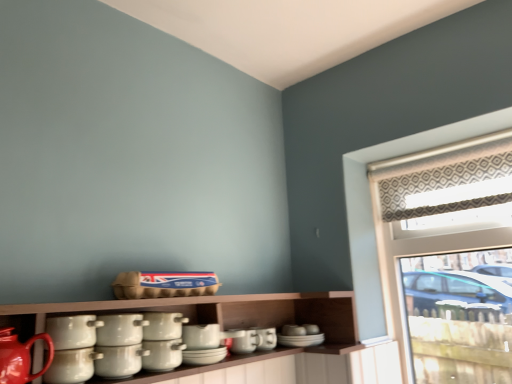
The height and width of the screenshot is (384, 512). Describe the element at coordinates (73, 331) in the screenshot. I see `white glossy pot at lower left, the second tableware from the front` at that location.

What is the approximate height of matte ceramic cup at center, which is the 9th tableware from front to back?

matte ceramic cup at center, which is the 9th tableware from front to back, is 3.18 inches in height.

The width and height of the screenshot is (512, 384). What are the coordinates of `white ceramic pot at center, marked as the 4th tableware in a back-to-front arrangement` in the screenshot? It's located at (163, 325).

Find the location of a particular element. matte red teapot at lower left is located at coordinates (20, 357).

Does matte white cup at center, marked as the second tableware in a back-to-front arrangement, contain white ceramic pot at center, marked as the 4th tableware in a back-to-front arrangement?

No, white ceramic pot at center, marked as the 4th tableware in a back-to-front arrangement, is not inside matte white cup at center, marked as the second tableware in a back-to-front arrangement.

Considering the sizes of objects matte white cup at center, marked as the second tableware in a back-to-front arrangement, and white ceramic pot at center, marked as the 4th tableware in a back-to-front arrangement, in the image provided, who is taller, matte white cup at center, marked as the second tableware in a back-to-front arrangement, or white ceramic pot at center, marked as the 4th tableware in a back-to-front arrangement,?

With more height is matte white cup at center, marked as the second tableware in a back-to-front arrangement.

Are matte white cup at center, marked as the second tableware in a back-to-front arrangement, and white ceramic pot at center, marked as the 4th tableware in a back-to-front arrangement, far apart?

No, matte white cup at center, marked as the second tableware in a back-to-front arrangement, is in close proximity to white ceramic pot at center, marked as the 4th tableware in a back-to-front arrangement.

Considering the sizes of matte white cup at center, which is the 8th tableware in front-to-back order, and white ceramic pot at center, marked as the 4th tableware in a back-to-front arrangement, in the image, is matte white cup at center, which is the 8th tableware in front-to-back order, bigger or smaller than white ceramic pot at center, marked as the 4th tableware in a back-to-front arrangement,?

matte white cup at center, which is the 8th tableware in front-to-back order, is smaller than white ceramic pot at center, marked as the 4th tableware in a back-to-front arrangement.

Could you tell me if white ceramic pot at center, marked as the 4th tableware in a back-to-front arrangement, is facing white glossy cup at center, which is counted as the 7th tableware, starting from the front?

No, white ceramic pot at center, marked as the 4th tableware in a back-to-front arrangement, is not turned towards white glossy cup at center, which is counted as the 7th tableware, starting from the front.

Identify the location of the 3rd tableware above the white glossy cup at center, which is counted as the 7th tableware, starting from the front (from the image's perspective). pyautogui.click(x=163, y=325).

Is the surface of white ceramic pot at center, marked as the 4th tableware in a back-to-front arrangement, in direct contact with white glossy cup at center, which is counted as the 7th tableware, starting from the front?

Yes, the surface of white ceramic pot at center, marked as the 4th tableware in a back-to-front arrangement, is in contact with white glossy cup at center, which is counted as the 7th tableware, starting from the front.

Is matte ceramic cup at center, the first tableware from the back, to the right of white glossy cup at left, which is the 9th tableware in back-to-front order, from the viewer's perspective?

Yes, matte ceramic cup at center, the first tableware from the back, is to the right of white glossy cup at left, which is the 9th tableware in back-to-front order.

Is matte ceramic cup at center, which is the 9th tableware from front to back, turned away from white glossy cup at left, acting as the first tableware starting from the front?

No, matte ceramic cup at center, which is the 9th tableware from front to back,'s orientation is not away from white glossy cup at left, acting as the first tableware starting from the front.

Is white glossy cup at left, acting as the first tableware starting from the front, completely or partially inside matte ceramic cup at center, the first tableware from the back?

No, white glossy cup at left, acting as the first tableware starting from the front, is not inside matte ceramic cup at center, the first tableware from the back.

Is matte red teapot at lower left closer to camera compared to white glossy pots at center, marked as the 3th tableware in a front-to-back arrangement?

Yes, matte red teapot at lower left is closer to the viewer.

Which object is thinner, matte red teapot at lower left or white glossy pots at center, marked as the 3th tableware in a front-to-back arrangement?

Thinner between the two is matte red teapot at lower left.

What's the angular difference between matte red teapot at lower left and white glossy pots at center, marked as the 3th tableware in a front-to-back arrangement,'s facing directions?

The angular difference between matte red teapot at lower left and white glossy pots at center, marked as the 3th tableware in a front-to-back arrangement, is 0.19 degrees.

Considering the points (6, 358) and (112, 353), which point is behind, point (6, 358) or point (112, 353)?

The point (112, 353) is behind.

Can you confirm if white glossy pot at center, placed as the sixth tableware when sorted from back to front, is taller than white glossy pots at center, marked as the 3th tableware in a front-to-back arrangement?

No, white glossy pot at center, placed as the sixth tableware when sorted from back to front, is not taller than white glossy pots at center, marked as the 3th tableware in a front-to-back arrangement.

Which object is more forward, white glossy pot at center, acting as the fourth tableware starting from the front, or white glossy pots at center, marked as the 3th tableware in a front-to-back arrangement?

white glossy pots at center, marked as the 3th tableware in a front-to-back arrangement, is closer to the camera.

The image size is (512, 384). I want to click on the 1st tableware to the left of the white glossy pot at center, placed as the sixth tableware when sorted from back to front, starting your count from the anchor, so click(x=119, y=361).

Does white glossy pot at center, placed as the sixth tableware when sorted from back to front, have a larger size compared to white glossy pots at center, the seventh tableware when ordered from back to front?

No, white glossy pot at center, placed as the sixth tableware when sorted from back to front, is not bigger than white glossy pots at center, the seventh tableware when ordered from back to front.

Based on their positions, is white glossy pots at center, marked as the 3th tableware in a front-to-back arrangement, located to the left or right of matte white cup at center, marked as the second tableware in a back-to-front arrangement?

white glossy pots at center, marked as the 3th tableware in a front-to-back arrangement, is to the left of matte white cup at center, marked as the second tableware in a back-to-front arrangement.

Can you tell me how much white glossy pots at center, marked as the 3th tableware in a front-to-back arrangement, and matte white cup at center, marked as the second tableware in a back-to-front arrangement, differ in facing direction?

The angular difference between white glossy pots at center, marked as the 3th tableware in a front-to-back arrangement, and matte white cup at center, marked as the second tableware in a back-to-front arrangement, is 0.000328 degrees.

From the image's perspective, starting from the matte white cup at center, marked as the second tableware in a back-to-front arrangement, which tableware is the 3rd one above? Please provide its 2D coordinates.

[(119, 361)]

From the image's perspective, which is below, white glossy pots at center, the seventh tableware when ordered from back to front, or matte white cup at center, marked as the second tableware in a back-to-front arrangement?

matte white cup at center, marked as the second tableware in a back-to-front arrangement.

Which of these two, patterned fabric at upper right or white glossy pot at lower left, the second tableware from the front, is wider?

Wider between the two is patterned fabric at upper right.

Which is behind, point (455, 216) or point (64, 344)?

The point (455, 216) is more distant.

Would you say patterned fabric at upper right is to the left or to the right of white glossy pot at lower left, the eighth tableware viewed from the back, in the picture?

From the image, it's evident that patterned fabric at upper right is to the right of white glossy pot at lower left, the eighth tableware viewed from the back.

Is patterned fabric at upper right beside white glossy pot at lower left, the second tableware from the front?

No, patterned fabric at upper right is not beside white glossy pot at lower left, the second tableware from the front.

Starting from the matte white cup at center, which is the 8th tableware in front-to-back order, which tableware is the 3rd one to the left? Please provide its 2D coordinates.

[(163, 325)]

Where is `tableware that is the 3rd one when counting upward from the white glossy cup at center, the third tableware positioned from the back (from the image's perspective)`? This screenshot has width=512, height=384. tableware that is the 3rd one when counting upward from the white glossy cup at center, the third tableware positioned from the back (from the image's perspective) is located at coordinates (163, 325).

Based on their spatial positions, is matte red teapot at lower left or matte white cup at center, marked as the second tableware in a back-to-front arrangement, closer to white ceramic pot at center, the sixth tableware in the front-to-back sequence?

matte white cup at center, marked as the second tableware in a back-to-front arrangement, is positioned closer to the anchor white ceramic pot at center, the sixth tableware in the front-to-back sequence.

Which object lies further to the anchor point white glossy pots at center, which is counted as the 5th tableware, starting from the back, white glossy cup at center, which is counted as the 7th tableware, starting from the front, or white glossy pot at center, acting as the fourth tableware starting from the front?

white glossy cup at center, which is counted as the 7th tableware, starting from the front, lies further to white glossy pots at center, which is counted as the 5th tableware, starting from the back, than the other object.

Looking at the image, which one is located closer to patterned fabric at upper right, white glossy cup at center, the third tableware positioned from the back, or white glossy pots at center, which is counted as the 5th tableware, starting from the back?

white glossy cup at center, the third tableware positioned from the back, is positioned closer to the anchor patterned fabric at upper right.

Based on their spatial positions, is white glossy cup at left, which is the 9th tableware in back-to-front order, or white glossy pot at center, acting as the fourth tableware starting from the front, further from patterned fabric at upper right?

Based on the image, white glossy cup at left, which is the 9th tableware in back-to-front order, appears to be further to patterned fabric at upper right.

Based on their spatial positions, is white glossy pot at center, acting as the fourth tableware starting from the front, or white glossy cup at center, which is counted as the 7th tableware, starting from the front, further from patterned fabric at upper right?

Based on the image, white glossy pot at center, acting as the fourth tableware starting from the front, appears to be further to patterned fabric at upper right.

Based on their spatial positions, is white glossy pot at center, acting as the fourth tableware starting from the front, or matte white cup at center, which is the 8th tableware in front-to-back order, closer to matte ceramic cup at center, which is the 9th tableware from front to back?

matte white cup at center, which is the 8th tableware in front-to-back order, is closer to matte ceramic cup at center, which is the 9th tableware from front to back.

Considering their positions, is white glossy pot at lower left, the eighth tableware viewed from the back, positioned further to patterned fabric at upper right than white ceramic pot at center, marked as the 4th tableware in a back-to-front arrangement?

Among the two, white glossy pot at lower left, the eighth tableware viewed from the back, is located further to patterned fabric at upper right.

Which object lies nearer to the anchor point matte ceramic cup at center, the first tableware from the back, matte white cup at center, marked as the second tableware in a back-to-front arrangement, or white glossy pot at lower left, the second tableware from the front?

The object closer to matte ceramic cup at center, the first tableware from the back, is matte white cup at center, marked as the second tableware in a back-to-front arrangement.

Find the location of a particular element. tableware positioned between white glossy cup at center, which is counted as the 7th tableware, starting from the front, and matte ceramic cup at center, the first tableware from the back, from near to far is located at coordinates (244, 341).

Locate an element on the screen. tableware between white ceramic pot at center, marked as the 4th tableware in a back-to-front arrangement, and white glossy cup at center, the third tableware positioned from the back, in the horizontal direction is located at coordinates (162, 355).

You are a GUI agent. You are given a task and a screenshot of the screen. Output one action in this format:
    pyautogui.click(x=<x>, y=<y>)
    Task: Click on the tableware between matte red teapot at lower left and white glossy pot at lower left, the second tableware from the front, from front to back
    
    Given the screenshot: What is the action you would take?
    pyautogui.click(x=72, y=366)

Where is `tableware between matte white cup at center, marked as the second tableware in a back-to-front arrangement, and patterned fabric at upper right, in the horizontal direction`? tableware between matte white cup at center, marked as the second tableware in a back-to-front arrangement, and patterned fabric at upper right, in the horizontal direction is located at coordinates (265, 338).